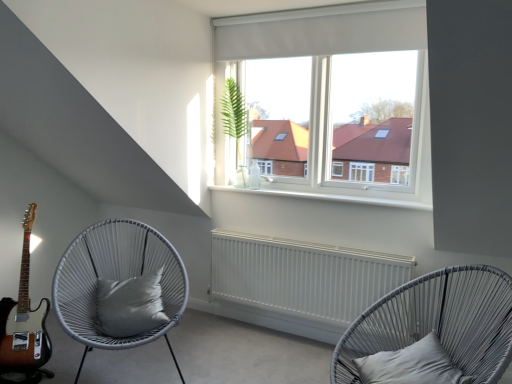
The width and height of the screenshot is (512, 384). I want to click on free spot to the right of white woven chair with cushion at left, the first chair when ordered from left to right, so click(x=234, y=359).